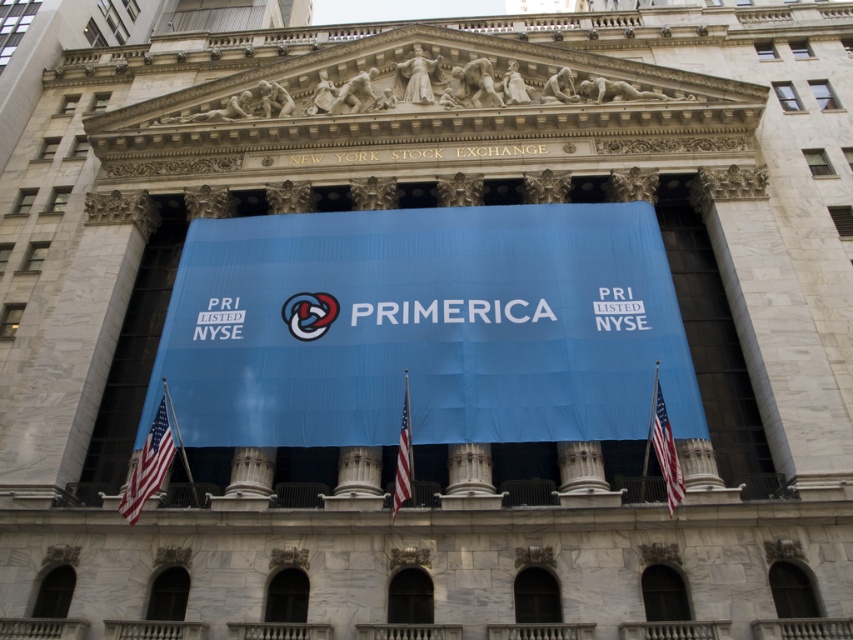
How much distance is there between blue fabric banner at center and red fabric flag at right?

blue fabric banner at center is 14.57 meters from red fabric flag at right.

Is point (466, 307) positioned behind point (657, 422)?

Yes.

Is point (573, 433) in front of point (651, 413)?

No.

Image resolution: width=853 pixels, height=640 pixels. In order to click on blue fabric banner at center in this screenshot , I will do `click(424, 326)`.

Based on the photo, can you confirm if white fabric flag at lower left is taller than red fabric flag at right?

Incorrect, white fabric flag at lower left's height is not larger of red fabric flag at right's.

Consider the image. Does white fabric flag at lower left appear under red fabric flag at right?

Yes.

What do you see at coordinates (149, 461) in the screenshot? The height and width of the screenshot is (640, 853). I see `white fabric flag at lower left` at bounding box center [149, 461].

You are a GUI agent. You are given a task and a screenshot of the screen. Output one action in this format:
    pyautogui.click(x=<x>, y=<y>)
    Task: Click on the white fabric flag at lower left
    The width and height of the screenshot is (853, 640).
    Given the screenshot: What is the action you would take?
    pyautogui.click(x=149, y=461)

Which of these two, blue fabric banner at center or white fabric flag at lower left, stands shorter?

With less height is white fabric flag at lower left.

Between blue fabric banner at center and white fabric flag at lower left, which one is positioned higher?

Positioned higher is blue fabric banner at center.

Is point (297, 397) farther from viewer compared to point (163, 426)?

Yes, it is.

I want to click on blue fabric banner at center, so click(x=424, y=326).